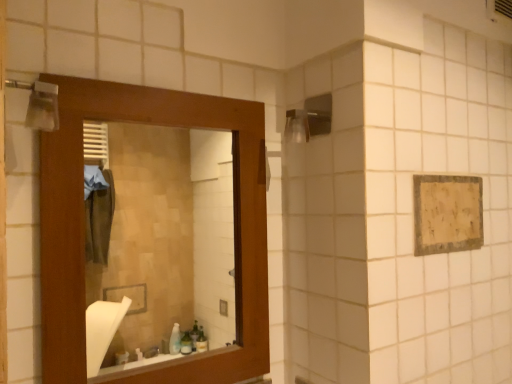
Question: From the image's perspective, is beige textured towel at upper right positioned above or below wooden mirror at left?

Choices:
 (A) above
 (B) below

Answer: (A)

Question: Looking at their shapes, would you say beige textured towel at upper right is wider or thinner than wooden mirror at left?

Choices:
 (A) thin
 (B) wide

Answer: (A)

Question: From a real-world perspective, is beige textured towel at upper right positioned above or below wooden mirror at left?

Choices:
 (A) above
 (B) below

Answer: (A)

Question: In the image, is wooden mirror at left positioned in front of or behind beige textured towel at upper right?

Choices:
 (A) front
 (B) behind

Answer: (A)

Question: Which is correct: wooden mirror at left is inside beige textured towel at upper right, or outside of it?

Choices:
 (A) outside
 (B) inside

Answer: (A)

Question: Is wooden mirror at left taller or shorter than beige textured towel at upper right?

Choices:
 (A) short
 (B) tall

Answer: (B)

Question: From the image's perspective, relative to beige textured towel at upper right, is wooden mirror at left above or below?

Choices:
 (A) above
 (B) below

Answer: (B)